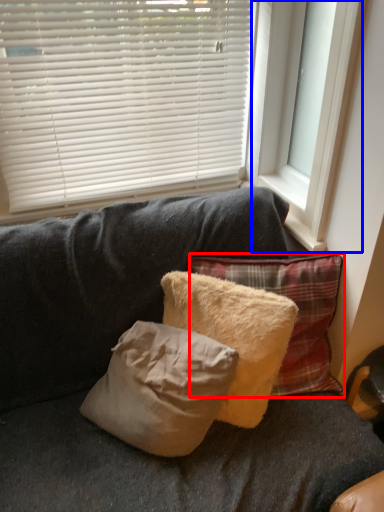
Question: Which of the following is the farthest to the observer, pillow (highlighted by a red box) or window frame (highlighted by a blue box)?

Choices:
 (A) pillow
 (B) window frame

Answer: (A)